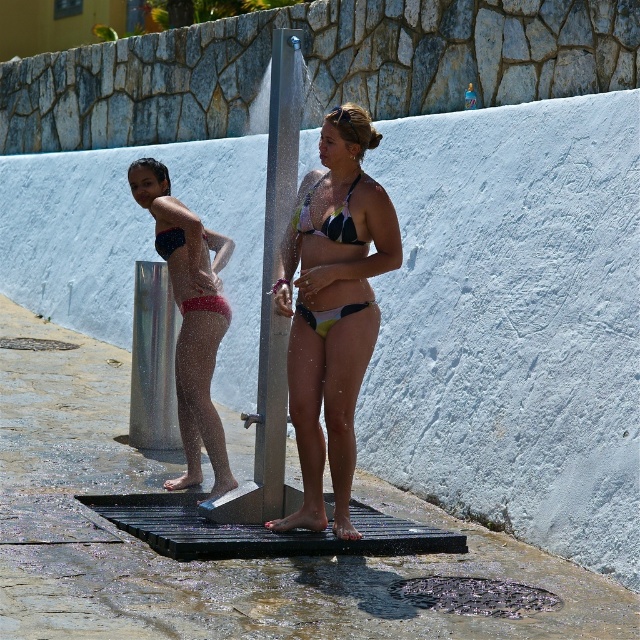
You are a photographer trying to capture both the matte black bikini at left and the matte black bikini at center under the showerhead. Since the showerhead is spraying water, you want to ensure both are fully visible. Which bikini is closer to the showerhead, and thus less likely to be obscured by water spray?

The matte black bikini at left is positioned under the matte black bikini at center, meaning it is closer to the showerhead and less likely to be obscured by water spray.

You are a lifeguard observing two swimmers at the poolside shower area. You notice the matte green bikini at center and the matte black bikini at center. Based on their positions, which swimmer is taller?

The matte green bikini at center has a greater height compared to the matte black bikini at center, so the swimmer wearing the matte green bikini at center is taller.